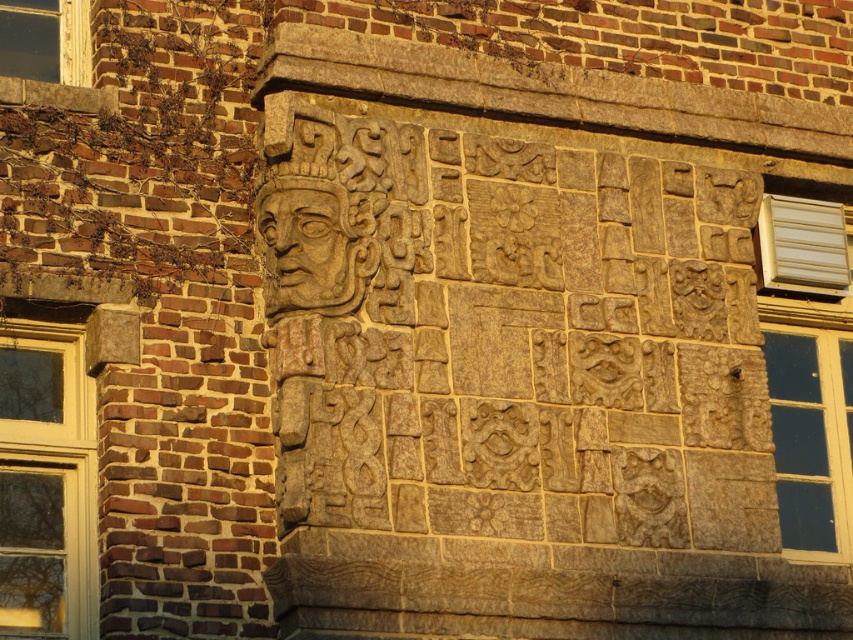
Question: Which object appears closest to the camera in this image?

Choices:
 (A) carved stone face at upper center
 (B) white painted wood window at lower left
 (C) white plastic air conditioner at right
 (D) clear glass window at upper left

Answer: (B)

Question: Can you confirm if white painted wood window at lower left is positioned above carved stone face at upper center?

Choices:
 (A) no
 (B) yes

Answer: (A)

Question: Is carved stone face at upper center to the right of clear glass window at upper left from the viewer's perspective?

Choices:
 (A) yes
 (B) no

Answer: (A)

Question: Does white plastic air conditioner at right appear on the left side of clear glass window at upper left?

Choices:
 (A) no
 (B) yes

Answer: (A)

Question: Which object appears closest to the camera in this image?

Choices:
 (A) carved stone face at upper center
 (B) white painted wood window at lower left
 (C) clear glass window at upper left
 (D) white plastic air conditioner at right

Answer: (B)

Question: Estimate the real-world distances between objects in this image. Which object is closer to the white painted wood window at lower left?

Choices:
 (A) white plastic air conditioner at right
 (B) carved stone face at upper center
 (C) clear glass window at upper left

Answer: (B)